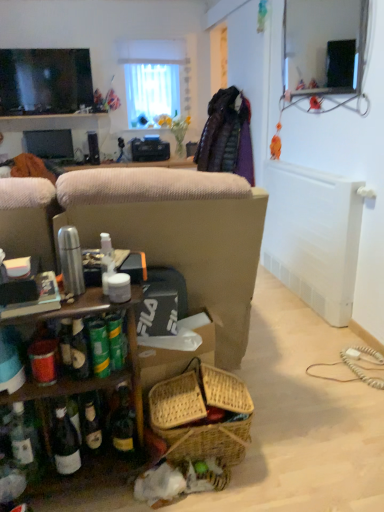
Where is `free location above white sheer curtain at upper center (from a real-world perspective)`? This screenshot has width=384, height=512. free location above white sheer curtain at upper center (from a real-world perspective) is located at coordinates (157, 36).